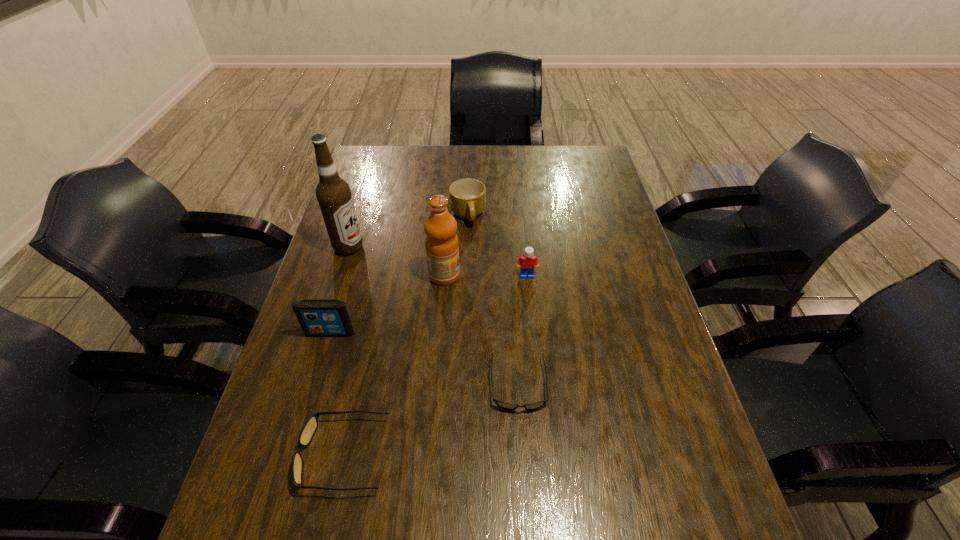
Considering the uniform spacing of sunglassess, where should an additional sunglasses be positioned on the right? Please locate a free spot. Please provide its 2D coordinates. Your answer should be formatted as a tuple, i.e. [(x, y)], where the tuple contains the x and y coordinates of a point satisfying the conditions above.

[(659, 329)]